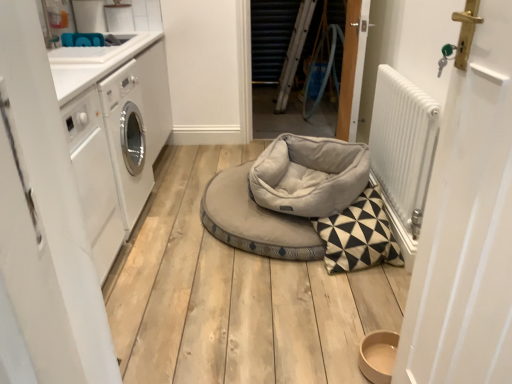
In order to face light gray fabric dog bed at center, the second dog bed from the front, should I rotate leftwards or rightwards?

You should rotate right by 3.044 degrees.

Identify the location of white glossy washing machine at left. (115, 136).

What is the approximate width of white matte door at left, arranged as the 2th door when viewed from the front?

white matte door at left, arranged as the 2th door when viewed from the front, is 10.78 inches wide.

Locate an element on the screen. white matte door at left, which ranks as the fourth door in right-to-left order is located at coordinates (44, 226).

What do you see at coordinates (352, 68) in the screenshot? I see `wooden door at center, which is the 1th door from right to left` at bounding box center [352, 68].

Locate an element on the screen. white glossy countertop at upper left is located at coordinates (93, 64).

The width and height of the screenshot is (512, 384). What do you see at coordinates (467, 225) in the screenshot? I see `white textured door at right, the fourth door positioned from the back` at bounding box center [467, 225].

Identify the location of white textured door at right, the fourth door positioned from the back. (467, 225).

You are a GUI agent. You are given a task and a screenshot of the screen. Output one action in this format:
    pyautogui.click(x=<x>, y=<y>)
    Task: Click on the light gray fabric dog bed at center, which is the first dog bed in back-to-front order
    The image size is (512, 384).
    Given the screenshot: What is the action you would take?
    pyautogui.click(x=255, y=221)

Choose the correct answer: Is white matte door at left, acting as the 3th door starting from the back, inside white glossy washing machine at left or outside it?

white matte door at left, acting as the 3th door starting from the back, is located beyond the bounds of white glossy washing machine at left.

From a real-world perspective, is white matte door at left, which ranks as the fourth door in right-to-left order, located beneath white glossy washing machine at left?

Incorrect, from a real-world perspective, white matte door at left, which ranks as the fourth door in right-to-left order, is higher than white glossy washing machine at left.

Between white matte door at left, arranged as the 2th door when viewed from the front, and white glossy washing machine at left, which one has larger width?

white glossy washing machine at left is wider.

Consider the image. Is white matte door at left, acting as the 3th door starting from the back, in front of or behind white glossy washing machine at left in the image?

Visually, white matte door at left, acting as the 3th door starting from the back, is located in front of white glossy washing machine at left.

Does white textured door at right, the fourth door positioned from the back, have a lesser width compared to white glossy countertop at upper left?

Yes, white textured door at right, the fourth door positioned from the back, is thinner than white glossy countertop at upper left.

Considering the relative sizes of white textured door at right, marked as the second door in a right-to-left arrangement, and white glossy countertop at upper left in the image provided, is white textured door at right, marked as the second door in a right-to-left arrangement, shorter than white glossy countertop at upper left?

No.

Could you tell me if white textured door at right, which appears as the 3th door when viewed from the left, is facing white glossy countertop at upper left?

No, white textured door at right, which appears as the 3th door when viewed from the left, does not turn towards white glossy countertop at upper left.

Is white textured door at right, marked as the second door in a right-to-left arrangement, located outside white glossy countertop at upper left?

Yes, white textured door at right, marked as the second door in a right-to-left arrangement, is outside of white glossy countertop at upper left.

I want to click on dog bed positioned vertically above the light gray fabric dog bed at center, the second dog bed from the front (from a real-world perspective), so click(309, 175).

Which of these two, light gray fabric dog bed at center, the second dog bed from the front, or soft gray fabric dog bed at center, placed as the 1th dog bed when sorted from front to back, stands taller?

With more height is soft gray fabric dog bed at center, placed as the 1th dog bed when sorted from front to back.

Does light gray fabric dog bed at center, which is the first dog bed in back-to-front order, have a smaller size compared to soft gray fabric dog bed at center, placed as the 1th dog bed when sorted from front to back?

Actually, light gray fabric dog bed at center, which is the first dog bed in back-to-front order, might be larger than soft gray fabric dog bed at center, placed as the 1th dog bed when sorted from front to back.

Is the position of light gray fabric dog bed at center, which is the first dog bed in back-to-front order, less distant than that of soft gray fabric dog bed at center, the 2th dog bed in the back-to-front sequence?

No, the depth of light gray fabric dog bed at center, which is the first dog bed in back-to-front order, is greater than that of soft gray fabric dog bed at center, the 2th dog bed in the back-to-front sequence.

Can we say wooden door at center, marked as the 4th door in a front-to-back arrangement, lies outside white glossy washing machine at left?

Indeed, wooden door at center, marked as the 4th door in a front-to-back arrangement, is completely outside white glossy washing machine at left.

Considering the positions of objects wooden door at center, the first door from the back, and white glossy washing machine at left in the image provided, who is more to the right, wooden door at center, the first door from the back, or white glossy washing machine at left?

wooden door at center, the first door from the back.

Locate an element on the screen. the 2nd door counting from the right of the white glossy washing machine at left is located at coordinates (280, 72).

Does point (320, 259) lie in front of point (135, 154)?

Yes, point (320, 259) is closer to viewer.

Consider the image. Does light gray fabric dog bed at center, which is the first dog bed in back-to-front order, have a greater width compared to white glossy washing machine at left?

Yes.

Could you tell me if soft gray fabric dog bed at center, placed as the 1th dog bed when sorted from front to back, is turned towards white glossy washing machine at left?

No.

Which is closer to the camera, (264, 199) or (98, 80)?

The point (98, 80) is more forward.

Can you confirm if soft gray fabric dog bed at center, the 2th dog bed in the back-to-front sequence, is shorter than white glossy washing machine at left?

Indeed, soft gray fabric dog bed at center, the 2th dog bed in the back-to-front sequence, has a lesser height compared to white glossy washing machine at left.

This screenshot has height=384, width=512. What are the coordinates of `washing machine above the soft gray fabric dog bed at center, placed as the 1th dog bed when sorted from front to back (from a real-world perspective)` in the screenshot? It's located at (115, 136).

Which is behind, point (292, 140) or point (494, 160)?

The point (292, 140) is farther from the camera.

Looking at this image, from the image's perspective, is soft gray fabric dog bed at center, the 2th dog bed in the back-to-front sequence, beneath white textured door at right, which appears as the 3th door when viewed from the left?

No, from the image's perspective, soft gray fabric dog bed at center, the 2th dog bed in the back-to-front sequence, is not beneath white textured door at right, which appears as the 3th door when viewed from the left.

Is white textured door at right, marked as the second door in a right-to-left arrangement, a part of soft gray fabric dog bed at center, the 2th dog bed in the back-to-front sequence?

Definitely not — white textured door at right, marked as the second door in a right-to-left arrangement, is not inside soft gray fabric dog bed at center, the 2th dog bed in the back-to-front sequence.

Looking at this image, is soft gray fabric dog bed at center, the 2th dog bed in the back-to-front sequence, turned away from white textured door at right, the 1th door viewed from the front?

No, white textured door at right, the 1th door viewed from the front, is not at the back of soft gray fabric dog bed at center, the 2th dog bed in the back-to-front sequence.

In order to click on the 1st door directly above the white glossy washing machine at left (from a real-world perspective) in this screenshot , I will do `click(44, 226)`.

Where is `the 2nd door in front of the white glossy countertop at upper left`? the 2nd door in front of the white glossy countertop at upper left is located at coordinates (467, 225).

Which object lies further to the anchor point white glossy countertop at upper left, light gray fabric dog bed at center, which is the first dog bed in back-to-front order, or wooden door at center, the fourth door in the left-to-right sequence?

Based on the image, wooden door at center, the fourth door in the left-to-right sequence, appears to be further to white glossy countertop at upper left.

In the scene shown: Which object lies nearer to the anchor point white glossy washing machine at left, wooden door at center, the first door from the back, or white metallic radiator at right?

Based on the image, white metallic radiator at right appears to be nearer to white glossy washing machine at left.

Looking at the image, which one is located closer to wooden door at center, which is the 1th door from right to left, white textured door at right, the 1th door viewed from the front, or white matte door at left, arranged as the 2th door when viewed from the front?

Among the two, white textured door at right, the 1th door viewed from the front, is located nearer to wooden door at center, which is the 1th door from right to left.

From the image, which object appears to be nearer to white glossy countertop at upper left, wooden door at center, the second door in the back-to-front sequence, or white metallic radiator at right?

white metallic radiator at right.

Estimate the real-world distances between objects in this image. Which object is further from wooden door at center, the second door in the back-to-front sequence, white matte door at left, arranged as the 2th door when viewed from the front, or wooden door at center, marked as the 4th door in a front-to-back arrangement?

white matte door at left, arranged as the 2th door when viewed from the front, lies further to wooden door at center, the second door in the back-to-front sequence, than the other object.

Estimate the real-world distances between objects in this image. Which object is closer to white glossy washing machine at left, white matte door at left, acting as the 3th door starting from the back, or wooden door at center, the second door in the back-to-front sequence?

wooden door at center, the second door in the back-to-front sequence.

Considering their positions, is soft gray fabric dog bed at center, the 2th dog bed in the back-to-front sequence, positioned further to white metallic radiator at right than white glossy countertop at upper left?

Based on the image, white glossy countertop at upper left appears to be further to white metallic radiator at right.

From the image, which object appears to be nearer to white metallic radiator at right, white textured door at right, which appears as the 3th door when viewed from the left, or wooden door at center, which is the 1th door from right to left?

wooden door at center, which is the 1th door from right to left, lies closer to white metallic radiator at right than the other object.

In order to click on door situated between white glossy countertop at upper left and light gray fabric dog bed at center, the second dog bed from the front, from left to right in this screenshot , I will do `click(44, 226)`.

Image resolution: width=512 pixels, height=384 pixels. I want to click on washing machine between white matte door at left, which ranks as the fourth door in right-to-left order, and wooden door at center, arranged as the 2th door when viewed from the left, from front to back, so click(115, 136).

Locate an element on the screen. radiator between wooden door at center, which is the 1th door from right to left, and light gray fabric dog bed at center, the second dog bed from the front, vertically is located at coordinates (403, 144).

Locate an element on the screen. This screenshot has width=512, height=384. door between white glossy washing machine at left and light gray fabric dog bed at center, the second dog bed from the front, in the horizontal direction is located at coordinates (44, 226).